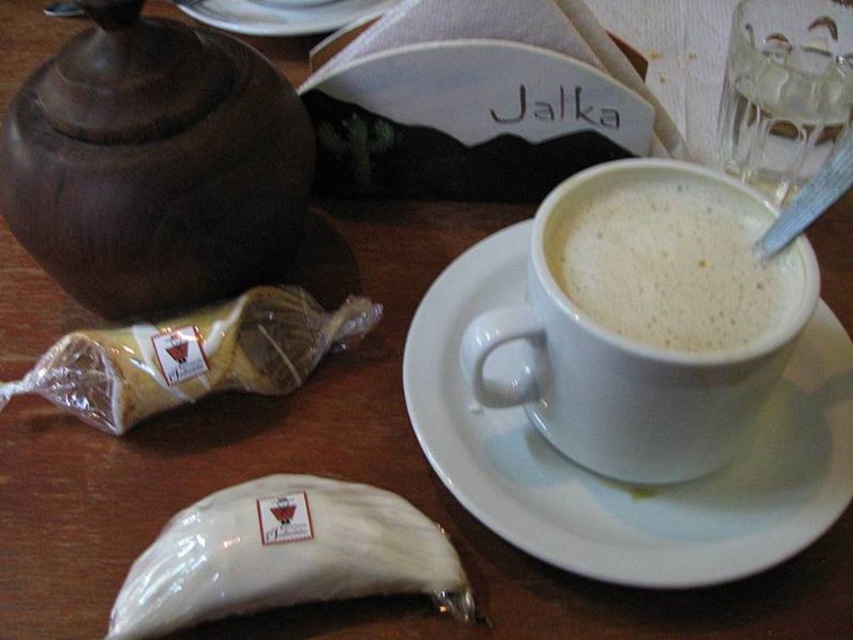
Who is positioned more to the right, brown matte teapot at left or white glossy pastry at lower left?

white glossy pastry at lower left

Describe the element at coordinates (154, 164) in the screenshot. This screenshot has width=853, height=640. I see `brown matte teapot at left` at that location.

Between point (282, 180) and point (431, 570), which one is positioned in front?

Point (431, 570) is in front.

Find the location of a particular element. The height and width of the screenshot is (640, 853). brown matte teapot at left is located at coordinates (154, 164).

Which is more to the left, white glossy pastry at lower left or white ceramic plate at upper center?

white ceramic plate at upper center

Who is more forward, (339, 481) or (184, 12)?

Positioned in front is point (339, 481).

This screenshot has height=640, width=853. I want to click on white glossy pastry at lower left, so click(285, 556).

Identify the location of white ceramic saucer at center. The image size is (853, 640). (619, 483).

Who is positioned more to the right, white ceramic saucer at center or white frothy coffee at center?

Positioned to the right is white frothy coffee at center.

At what (x,y) coordinates should I click in order to perform the action: click on white ceramic saucer at center. Please return your answer as a coordinate pair (x, y). Looking at the image, I should click on (619, 483).